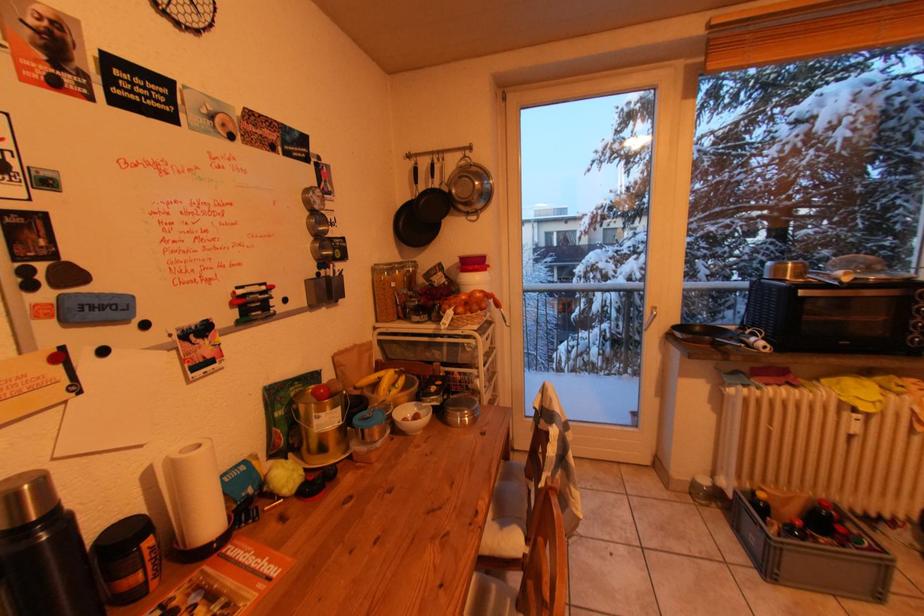
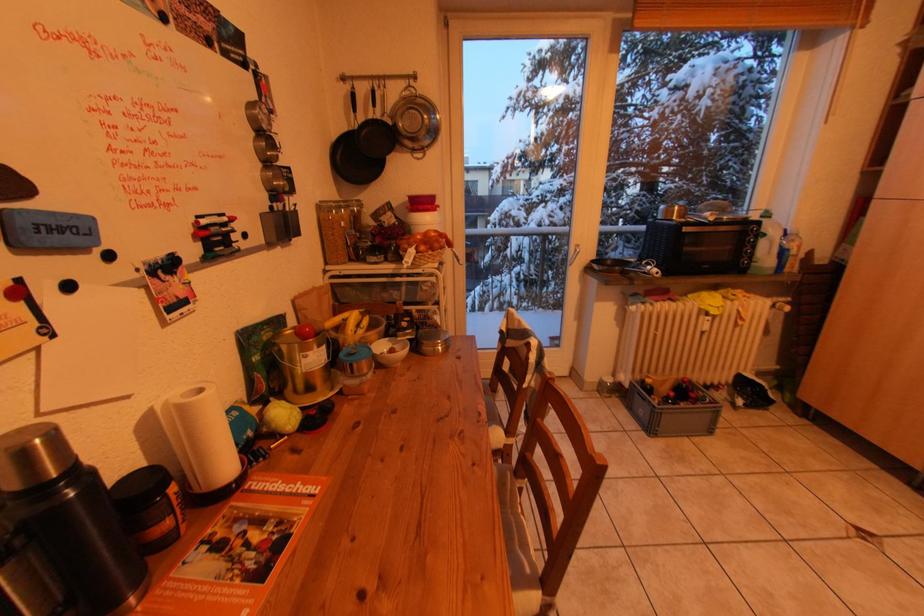
Question: In a continuous first-person perspective shot, in which direction is the camera moving?

Choices:
 (A) Left
 (B) Right
 (C) Forward
 (D) Backward

Answer: (A)